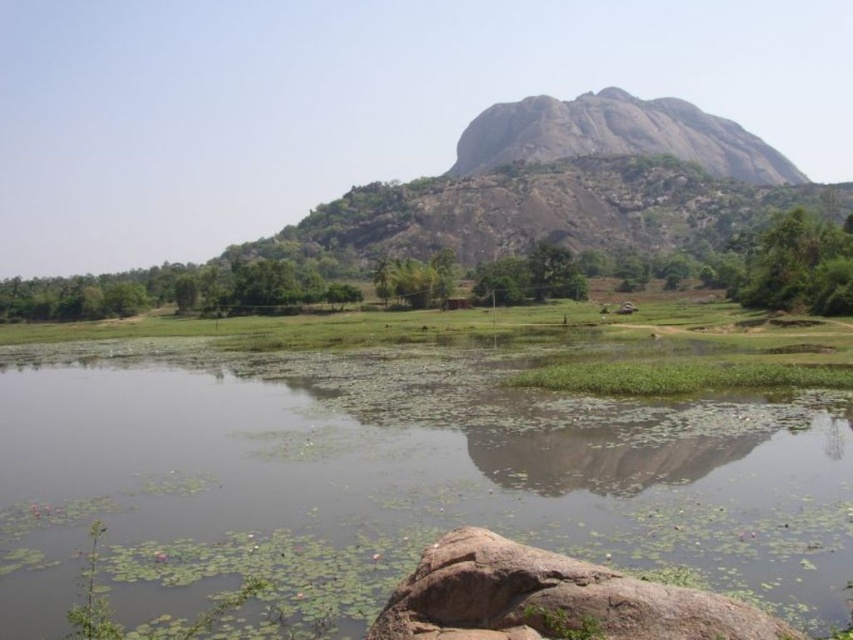
Looking at this image, you are standing at the edge of the green grassy field at center and want to walk to the green leafy tree at right. Which direction should you move to reach the tree?

You should move to the right because the green leafy tree at right is located to the right side of the green grassy field at center.

You are standing at the edge of the pond and notice a point marked at coordinates (698, 268). According to the scene description, which object does this point belong to?

The point at coordinates (698, 268) is on the green leafy tree at center.